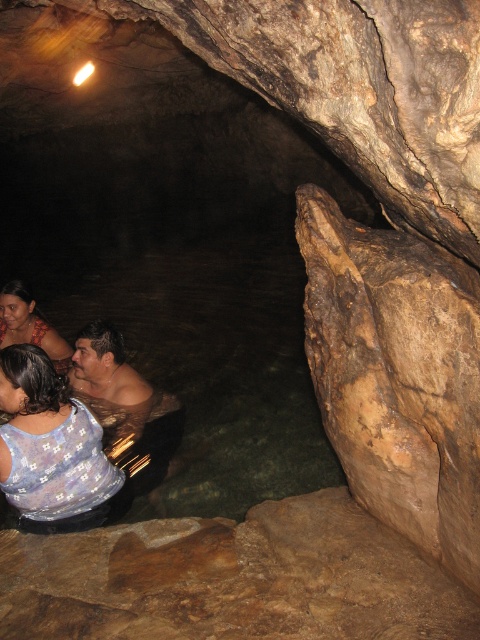
You are a photographer trying to capture the texture details of the printed fabric blouse at lower left and the matte brown hair at lower left in the dimly lit cave. Which object would require more light to be properly illuminated?

The printed fabric blouse at lower left is thinner than matte brown hair at lower left, so it would require more light to be properly illuminated because thinner materials often scatter light less efficiently and may appear darker in low light conditions.

You are standing at the entrance of the cave and want to place a small lantern on the closest object to the light source. Which object should you choose between the brown rough rock at lower center and the printed fabric blouse at lower left?

The printed fabric blouse at lower left is closer to the light source at the top left corner, so you should place the lantern there.